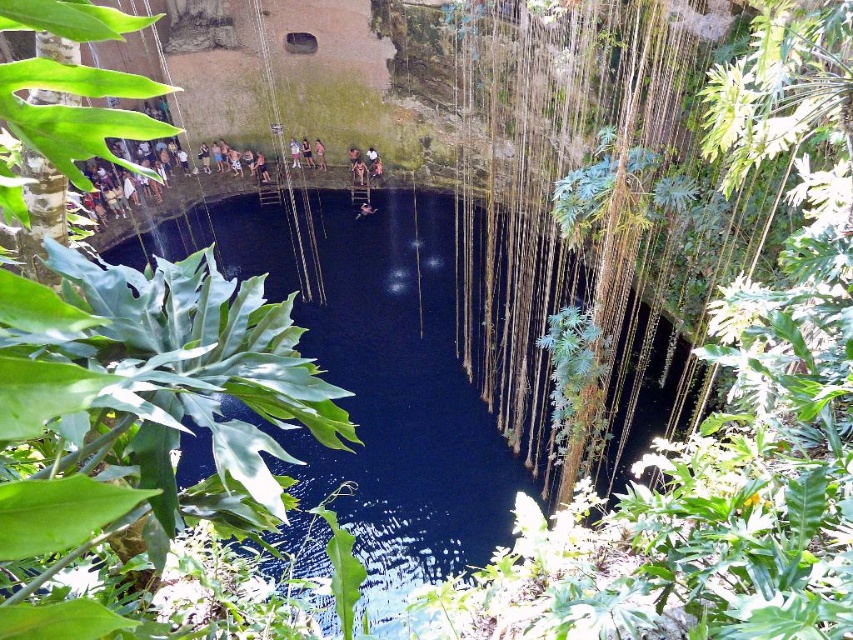
You are a visitor at the cenote and want to know which object is shorter between the light brown wooden pole at center and the pink fabric dress at center. Can you tell me?

The light brown wooden pole at center is not as tall as the pink fabric dress at center, so the wooden pole is shorter.

You are a diver standing at point (320, 141) and want to move to point (296, 144). Which direction should you move in to reach your destination?

You should move forward to reach point (296, 144) because it is behind point (320, 141) from your current position.

You are a visitor at the cenote and want to jump into the transparent water at center. There is a light brown wooden pole at center in your way. Can you safely jump over it?

The transparent water at center is much taller than the light brown wooden pole at center, so yes, you can safely jump over the light brown wooden pole at center into the transparent water at center.